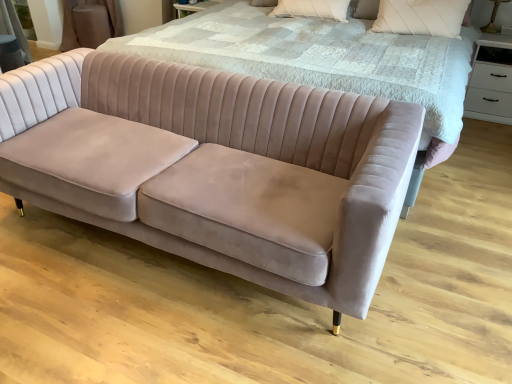
Question: Would you say matte gold table lamp at upper right is inside or outside velvet bed at center?

Choices:
 (A) outside
 (B) inside

Answer: (B)

Question: Is matte gold table lamp at upper right wider or thinner than velvet bed at center?

Choices:
 (A) wide
 (B) thin

Answer: (B)

Question: Which object is the farthest from the white textured pillow at upper right, which is the 2th pillow in left-to-right order?

Choices:
 (A) velvet bed at center
 (B) matte gold table lamp at upper right
 (C) velvet beige couch at lower left
 (D) white textured pillow at upper center, positioned as the second pillow in right-to-left order
 (E) white glossy drawer at upper right

Answer: (C)

Question: Which object is the closest to the white textured pillow at upper right, marked as the first pillow in a right-to-left arrangement?

Choices:
 (A) matte gold table lamp at upper right
 (B) velvet bed at center
 (C) white glossy drawer at upper right
 (D) white textured pillow at upper center, positioned as the second pillow in right-to-left order
 (E) velvet beige couch at lower left

Answer: (D)